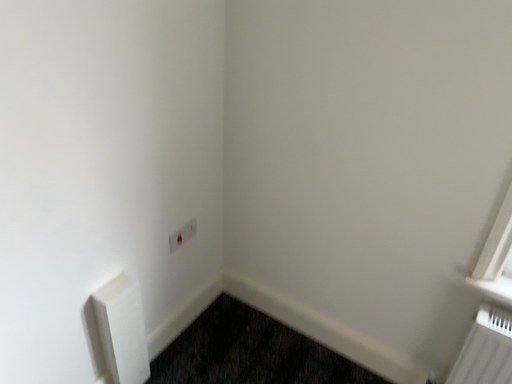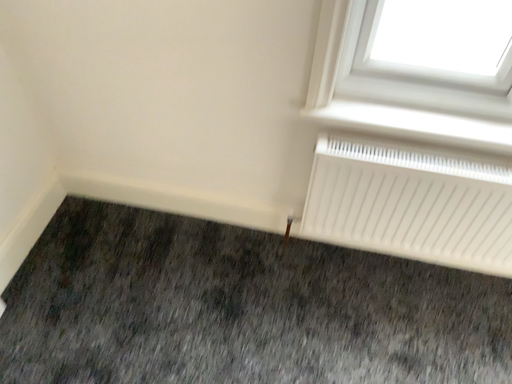
Question: How did the camera likely rotate when shooting the video?

Choices:
 (A) rotated left
 (B) rotated right

Answer: (B)